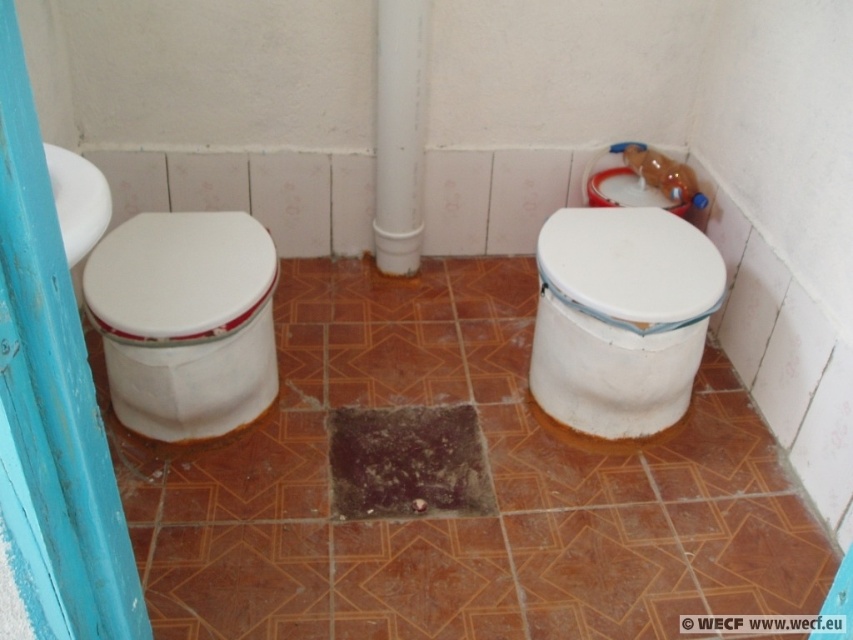
You are a plumber inspecting the bathroom and need to locate the white plastic pipe at center. According to the scene, where should you look in relation to the white glossy toilet at right?

The white glossy toilet at right is positioned under the white plastic pipe at center, so the pipe is above the toilet.